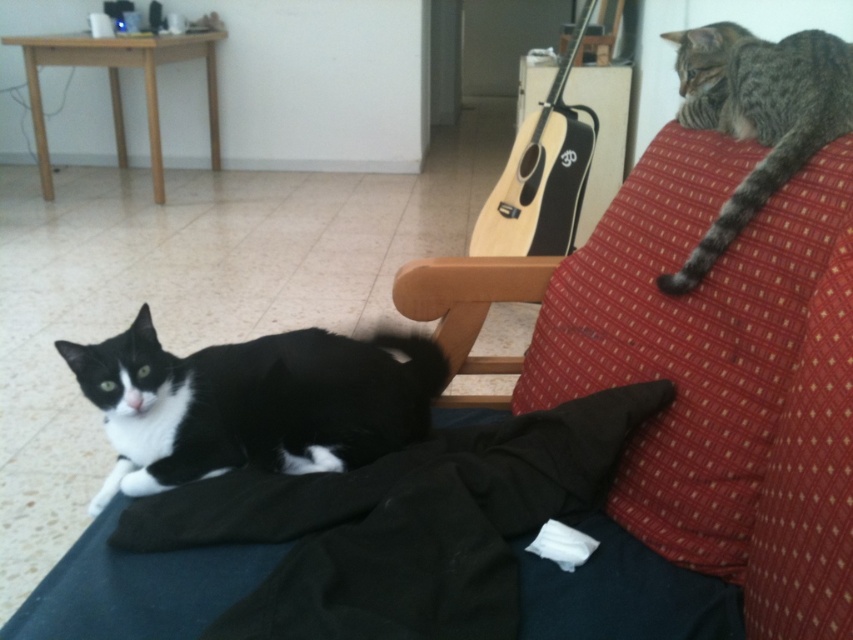
Who is higher up, tabby fur cat at upper right or light wood acoustic guitar at upper center?

light wood acoustic guitar at upper center is higher up.

Who is more forward, (741, 182) or (569, 61)?

Point (741, 182) is in front.

Does point (753, 189) come behind point (553, 77)?

No, (753, 189) is in front of (553, 77).

Where is `tabby fur cat at upper right`? tabby fur cat at upper right is located at coordinates (757, 115).

Can you confirm if red textured pillow at upper right is bigger than tabby fur cat at upper right?

Correct, red textured pillow at upper right is larger in size than tabby fur cat at upper right.

The image size is (853, 640). I want to click on red textured pillow at upper right, so click(x=691, y=333).

From the picture: Is the position of black and white fur cat at lower left less distant than that of tabby fur cat at upper right?

No, it is behind tabby fur cat at upper right.

Which is behind, point (386, 435) or point (741, 32)?

Positioned behind is point (741, 32).

The image size is (853, 640). I want to click on black and white fur cat at lower left, so click(x=253, y=403).